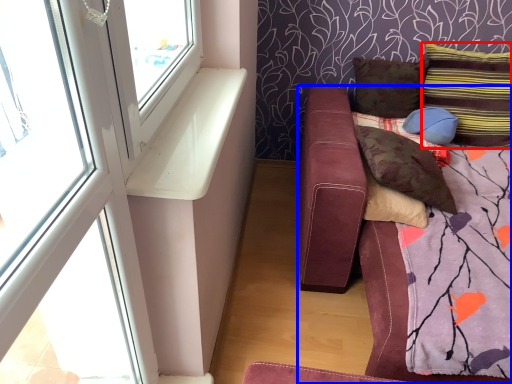
Question: Which object is further to the camera taking this photo, pillow (highlighted by a red box) or studio couch (highlighted by a blue box)?

Choices:
 (A) pillow
 (B) studio couch

Answer: (A)